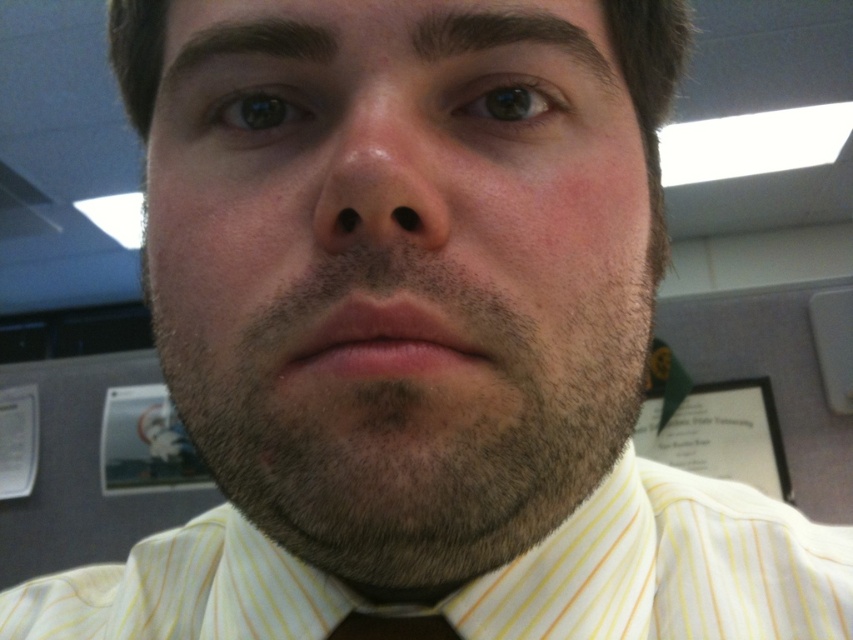
Between yellow striped shirt at center and pinkish skin nose at center, which one is positioned lower?

Positioned lower is yellow striped shirt at center.

Between yellow striped shirt at center and pinkish skin nose at center, which one is positioned higher?

Positioned higher is pinkish skin nose at center.

This screenshot has width=853, height=640. What do you see at coordinates (488, 577) in the screenshot?
I see `yellow striped shirt at center` at bounding box center [488, 577].

Find the location of a particular element. The image size is (853, 640). yellow striped shirt at center is located at coordinates (488, 577).

Can you confirm if smooth skin face at center is thinner than pinkish skin nose at center?

In fact, smooth skin face at center might be wider than pinkish skin nose at center.

Who is more distant from viewer, [601,96] or [392,144]?

Positioned behind is point [601,96].

Is point (424, 26) positioned behind point (381, 112)?

Yes.

The height and width of the screenshot is (640, 853). In order to click on smooth skin face at center in this screenshot , I will do `click(398, 264)`.

Which of these two, pinkish skin nose at center or white paper at right, stands shorter?

pinkish skin nose at center

Measure the distance from pinkish skin nose at center to white paper at right.

The distance of pinkish skin nose at center from white paper at right is 2.68 meters.

What do you see at coordinates (378, 186) in the screenshot? The image size is (853, 640). I see `pinkish skin nose at center` at bounding box center [378, 186].

You are a GUI agent. You are given a task and a screenshot of the screen. Output one action in this format:
    pyautogui.click(x=<x>, y=<y>)
    Task: Click on the pinkish skin nose at center
    
    Given the screenshot: What is the action you would take?
    tap(378, 186)